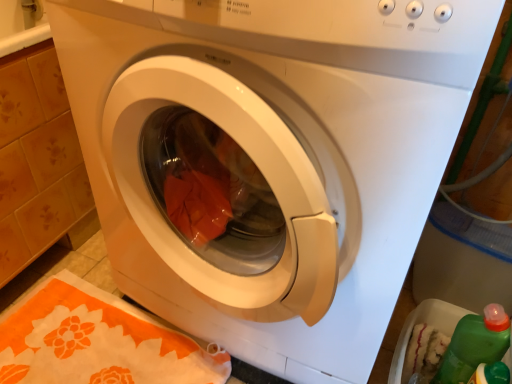
Measure the distance between point (28, 309) and camera.

They are 1.03 meters apart.

The image size is (512, 384). Describe the element at coordinates (96, 341) in the screenshot. I see `orange fabric bath towel at lower left` at that location.

Identify the location of orange fabric bath towel at lower left. (96, 341).

Locate an element on the screen. The image size is (512, 384). orange fabric bath towel at lower left is located at coordinates (96, 341).